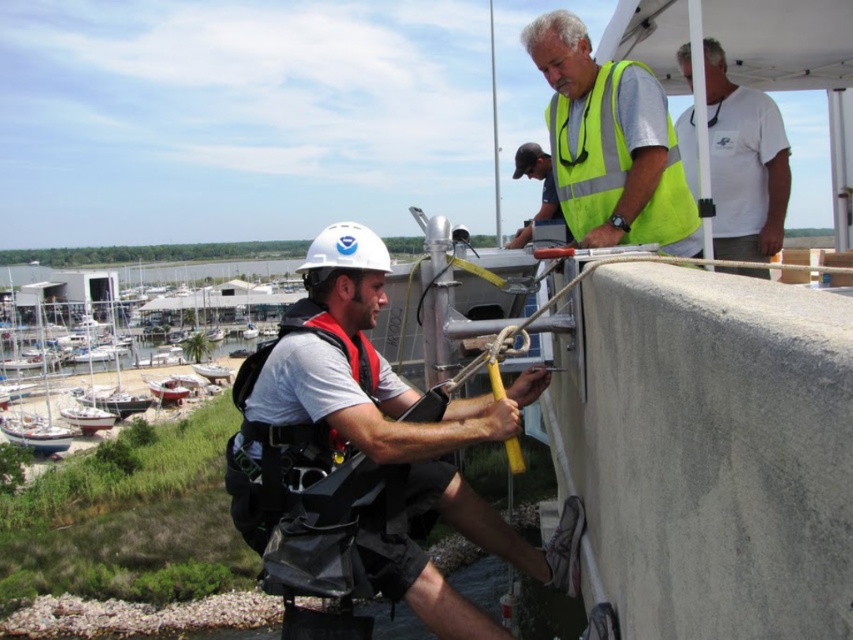
Is white matte helmet at center wider than dark gray baseball cap at upper center?

No, white matte helmet at center is not wider than dark gray baseball cap at upper center.

Does white matte helmet at center appear under dark gray baseball cap at upper center?

Yes.

Who is more forward, (289, 368) or (525, 157)?

Positioned in front is point (289, 368).

Find the location of a particular element. white matte helmet at center is located at coordinates (376, 440).

You are a GUI agent. You are given a task and a screenshot of the screen. Output one action in this format:
    pyautogui.click(x=<x>, y=<y>)
    Task: Click on the white matte helmet at center
    
    Given the screenshot: What is the action you would take?
    pyautogui.click(x=376, y=440)

Looking at this image, does white matte helmet at center have a greater height compared to yellow reflective vest at upper right?

In fact, white matte helmet at center may be shorter than yellow reflective vest at upper right.

Where is `white matte helmet at center`? white matte helmet at center is located at coordinates (376, 440).

Does white matte helmet at center have a smaller size compared to neon yellow reflective vest at upper center?

Yes, white matte helmet at center is smaller than neon yellow reflective vest at upper center.

Between point (258, 532) and point (630, 147), which one is positioned behind?

Point (630, 147)

The width and height of the screenshot is (853, 640). I want to click on white matte helmet at center, so click(x=376, y=440).